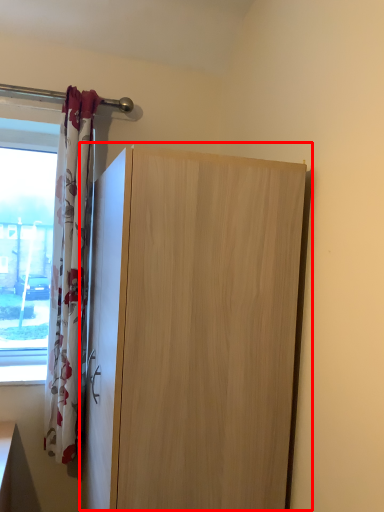
Question: In this image, where is cupboard (annotated by the red box) located relative to curtain?

Choices:
 (A) left
 (B) right

Answer: (B)